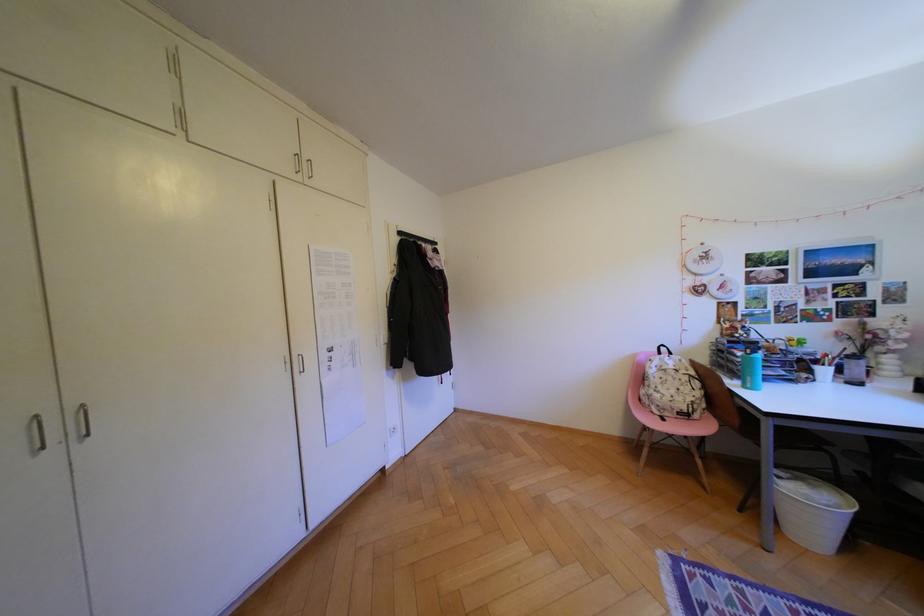
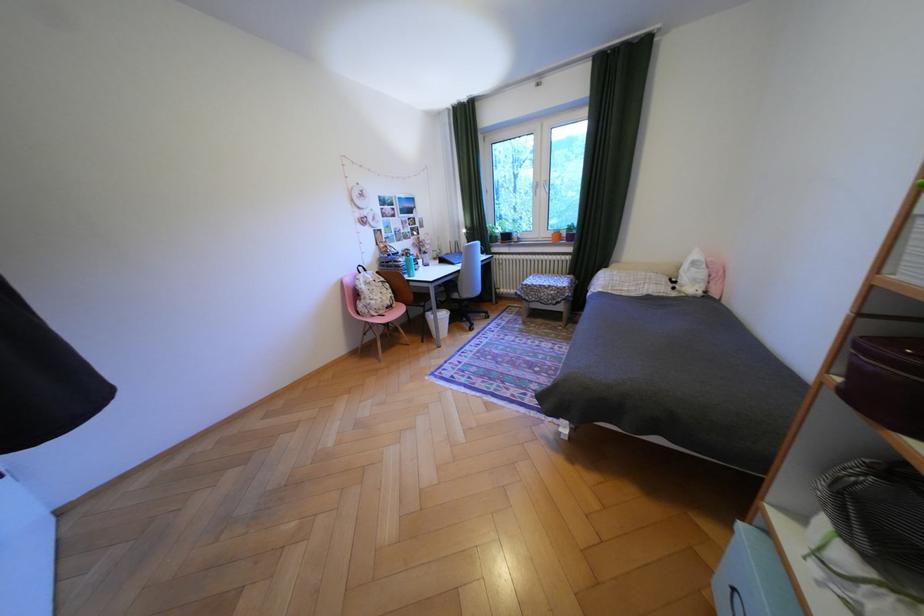
The point at (678, 414) is marked in the first image. Where is the corresponding point in the second image?

(393, 312)